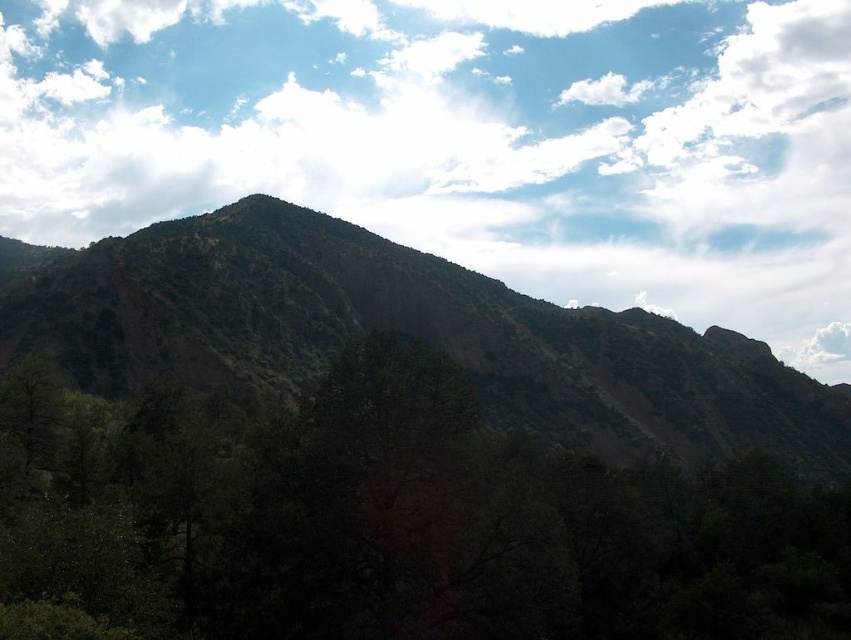
Question: Which point is farther to the camera?

Choices:
 (A) (724, 349)
 (B) (500, 568)
 (C) (798, 92)

Answer: (C)

Question: Is white fluffy cloud at upper center wider than green textured hillside at center?

Choices:
 (A) no
 (B) yes

Answer: (B)

Question: Does green leafy tree at center have a lesser width compared to green textured hillside at center?

Choices:
 (A) no
 (B) yes

Answer: (B)

Question: Which of these objects is positioned farthest from the white fluffy cloud at upper center?

Choices:
 (A) green textured hillside at center
 (B) green leafy tree at center

Answer: (B)

Question: Does white fluffy cloud at upper center appear over green textured hillside at center?

Choices:
 (A) yes
 (B) no

Answer: (A)

Question: Which point is farther from the camera taking this photo?

Choices:
 (A) pos(730,67)
 (B) pos(735,470)

Answer: (A)